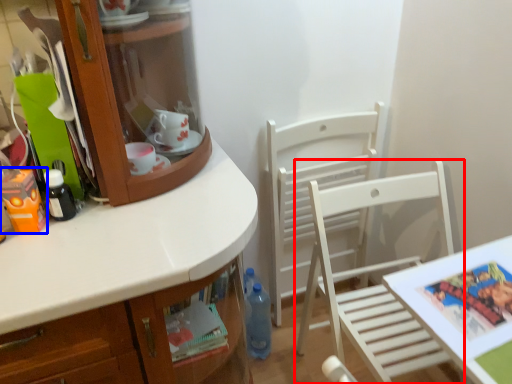
Question: Which object is further to the camera taking this photo, chair (highlighted by a red box) or toy (highlighted by a blue box)?

Choices:
 (A) chair
 (B) toy

Answer: (B)